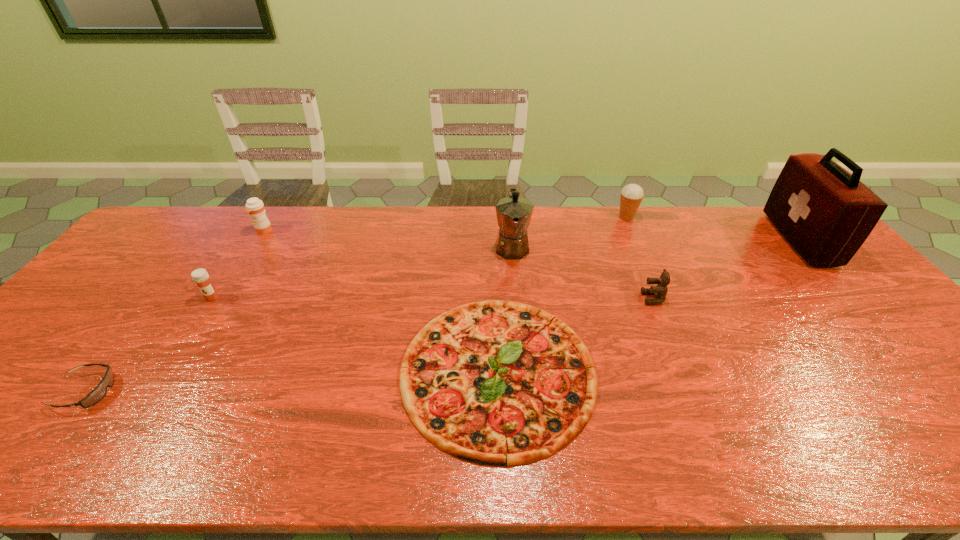
You are a GUI agent. You are given a task and a screenshot of the screen. Output one action in this format:
    pyautogui.click(x=<x>, y=<y>)
    Task: Click on the free spot at the far edge of the desktop
    This screenshot has width=960, height=540.
    Given the screenshot: What is the action you would take?
    pyautogui.click(x=667, y=235)

In order to click on vacant space at the near edge of the desktop in this screenshot , I will do `click(885, 462)`.

Identify the location of free space at the left edge. (153, 251).

You are a GUI agent. You are given a task and a screenshot of the screen. Output one action in this format:
    pyautogui.click(x=<x>, y=<y>)
    Task: Click on the vacant space at the far left corner of the desktop
    This screenshot has width=960, height=540.
    Given the screenshot: What is the action you would take?
    pyautogui.click(x=175, y=241)

I want to click on vacant space at the far right corner of the desktop, so click(788, 247).

The image size is (960, 540). In the image, there is a desktop. Identify the location of vacant space at the near right corner. (941, 438).

The image size is (960, 540). What are the coordinates of `free space between the icecream and the rightmost object` in the screenshot? It's located at (712, 228).

I want to click on free space between the farther medicine and the icecream, so click(x=444, y=224).

The height and width of the screenshot is (540, 960). In order to click on free space between the icecream and the pizza in this screenshot , I will do `click(563, 294)`.

Locate an element on the screen. vacant space that's between the teddy bear and the icecream is located at coordinates (639, 258).